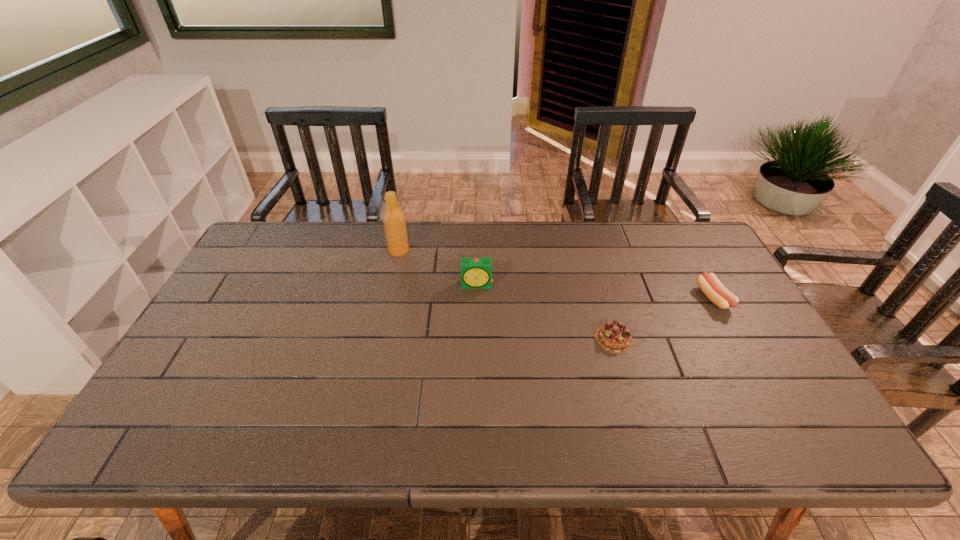
This screenshot has width=960, height=540. In order to click on the leftmost object in this screenshot , I will do `click(394, 221)`.

Find the location of `the farthest object`. the farthest object is located at coordinates (394, 221).

This screenshot has height=540, width=960. What are the coordinates of `alarm clock` in the screenshot? It's located at (476, 272).

The height and width of the screenshot is (540, 960). Find the location of `the second object from left to right`. the second object from left to right is located at coordinates [476, 272].

Locate an element on the screen. This screenshot has width=960, height=540. sausage is located at coordinates (714, 290).

In order to click on the nearest object in this screenshot , I will do coord(614,337).

At what (x,y) coordinates should I click in order to perform the action: click on chocolate cake. Please return your answer as a coordinate pair (x, y). Looking at the image, I should click on (614, 337).

At what (x,y) coordinates should I click in order to perform the action: click on blank space located 0.100m on the right of the tallest object. Please return your answer as a coordinate pair (x, y). The width and height of the screenshot is (960, 540). Looking at the image, I should click on (440, 251).

This screenshot has height=540, width=960. What are the coordinates of `free space located on the front-facing side of the alarm clock` in the screenshot? It's located at [x=476, y=371].

Locate an element on the screen. This screenshot has height=540, width=960. vacant space located 0.260m on the left of the rightmost object is located at coordinates (612, 299).